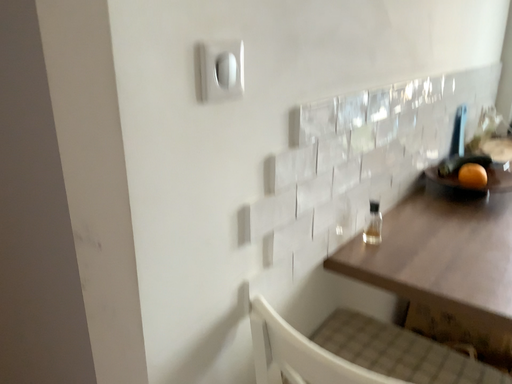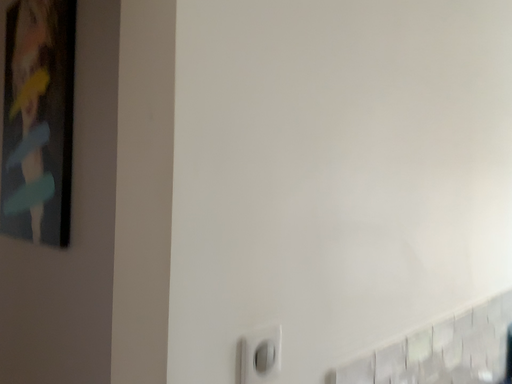
Question: How did the camera likely rotate when shooting the video?

Choices:
 (A) rotated downward
 (B) rotated upward

Answer: (B)